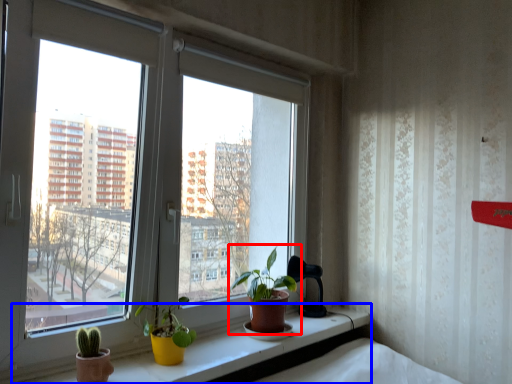
Question: Which of the following is the farthest to the observer, houseplant (highlighted by a red box) or window sill (highlighted by a blue box)?

Choices:
 (A) houseplant
 (B) window sill

Answer: (A)